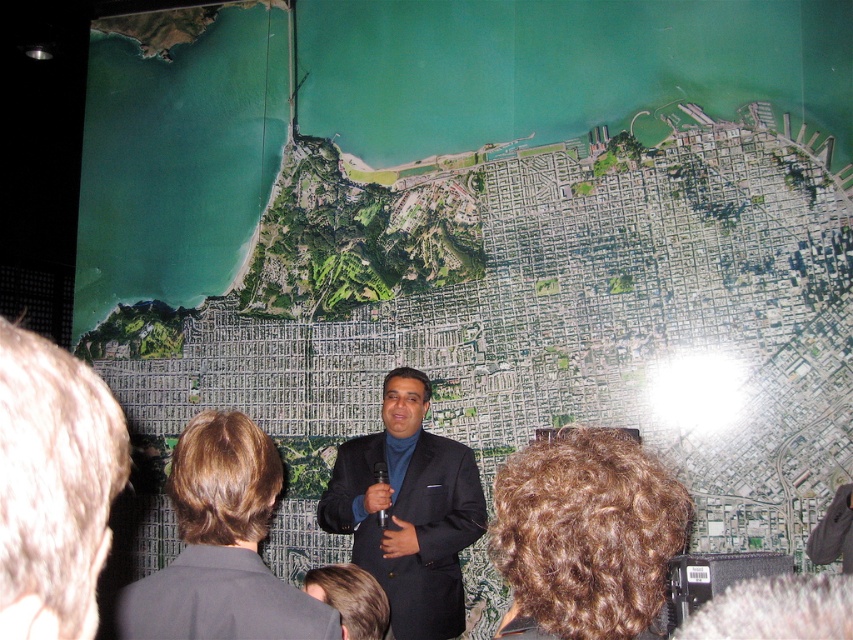
Question: Is the position of black suit at center more distant than that of matte black suit at center?

Choices:
 (A) yes
 (B) no

Answer: (B)

Question: Which of the following is the closest to the observer?

Choices:
 (A) (276, 625)
 (B) (473, 493)

Answer: (A)

Question: Among these points, which one is farthest from the camera?

Choices:
 (A) (189, 445)
 (B) (416, 528)

Answer: (B)

Question: Which point is closer to the camera?

Choices:
 (A) [370, 554]
 (B) [213, 422]

Answer: (B)

Question: Can you confirm if black suit at center is positioned to the left of matte black suit at center?

Choices:
 (A) no
 (B) yes

Answer: (B)

Question: Is black suit at center above matte black suit at center?

Choices:
 (A) yes
 (B) no

Answer: (A)